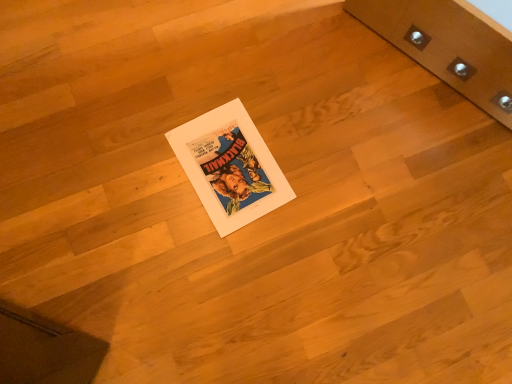
This screenshot has width=512, height=384. Find the location of `free space above white paper magazine at center (from a real-world perspective)`. free space above white paper magazine at center (from a real-world perspective) is located at coordinates (229, 165).